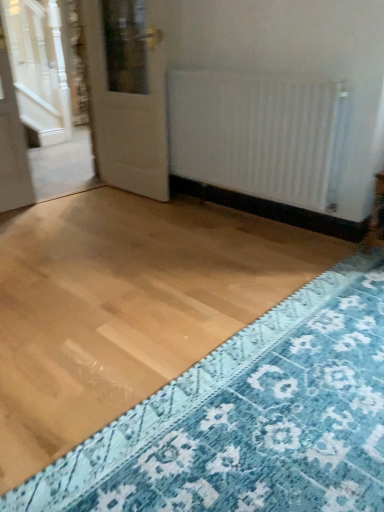
Question: Considering the positions of white glossy door at upper left and white matte radiator at center in the image, is white glossy door at upper left taller or shorter than white matte radiator at center?

Choices:
 (A) short
 (B) tall

Answer: (B)

Question: Considering the positions of point (105, 129) and point (203, 129), is point (105, 129) closer or farther from the camera than point (203, 129)?

Choices:
 (A) farther
 (B) closer

Answer: (A)

Question: Which object is positioned closest to the white glossy door at upper left?

Choices:
 (A) white matte radiator at center
 (B) blue textured rug at lower right

Answer: (A)

Question: Estimate the real-world distances between objects in this image. Which object is closer to the white matte radiator at center?

Choices:
 (A) blue textured rug at lower right
 (B) white glossy door at upper left

Answer: (B)